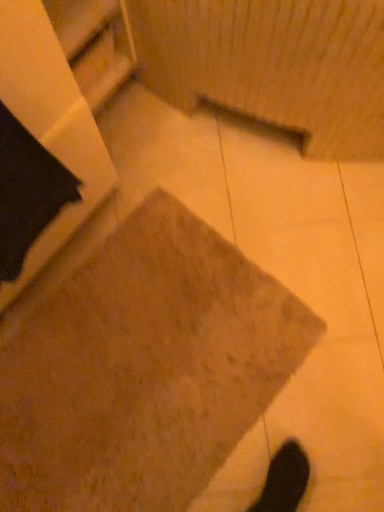
Identify the location of vacant space to the right of brown textured concrete at center. This screenshot has width=384, height=512. (319, 334).